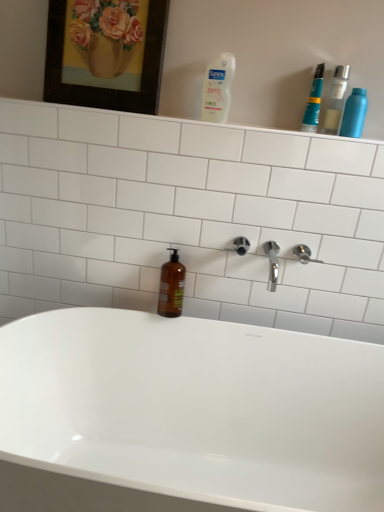
Where is `vacant region to the left of white plastic bottle at upper center, which is the second cleaning product in right-to-left order`? vacant region to the left of white plastic bottle at upper center, which is the second cleaning product in right-to-left order is located at coordinates (176, 116).